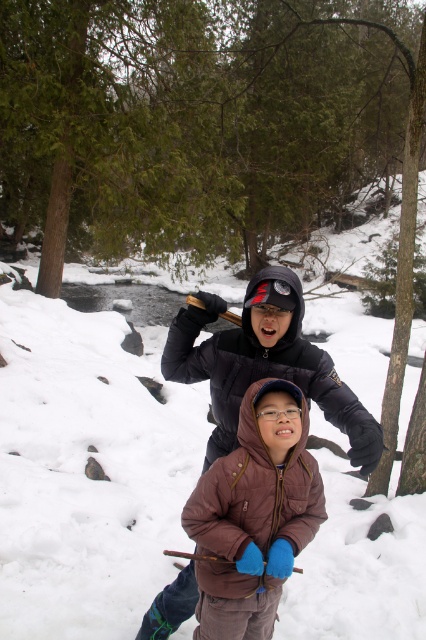
Does white fluffy snow at center appear over brown leather jacket at center?

Yes.

Is white fluffy snow at center below brown leather jacket at center?

No.

Who is more forward, (x=17, y=627) or (x=265, y=554)?

Point (x=265, y=554)

You are a GUI agent. You are given a task and a screenshot of the screen. Output one action in this format:
    pyautogui.click(x=<x>, y=<y>)
    Task: Click on the white fluffy snow at center
    The height and width of the screenshot is (640, 426).
    Given the screenshot: What is the action you would take?
    pyautogui.click(x=85, y=464)

Is point (296, 444) closer to camera compared to point (183, 595)?

Yes, it is in front of point (183, 595).

Who is taller, brown leather jacket at center or brown matte jacket at center?

brown leather jacket at center is taller.

Locate an element on the screen. The height and width of the screenshot is (640, 426). brown leather jacket at center is located at coordinates (255, 515).

The image size is (426, 640). Find the location of `brown leather jacket at center`. brown leather jacket at center is located at coordinates (255, 515).

Which is below, white fluffy snow at center or brown matte jacket at center?

brown matte jacket at center

Locate an element on the screen. The width and height of the screenshot is (426, 640). white fluffy snow at center is located at coordinates (85, 464).